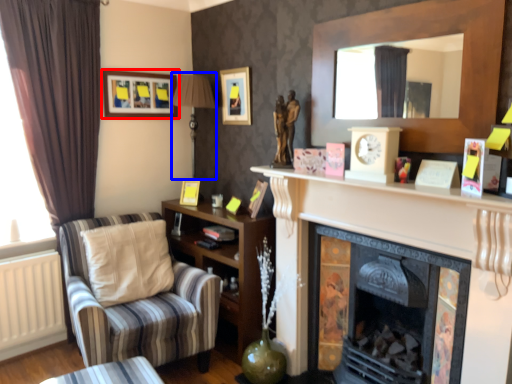
Question: Which point is further to the camera, picture frame (highlighted by a red box) or lamp (highlighted by a blue box)?

Choices:
 (A) picture frame
 (B) lamp

Answer: (A)